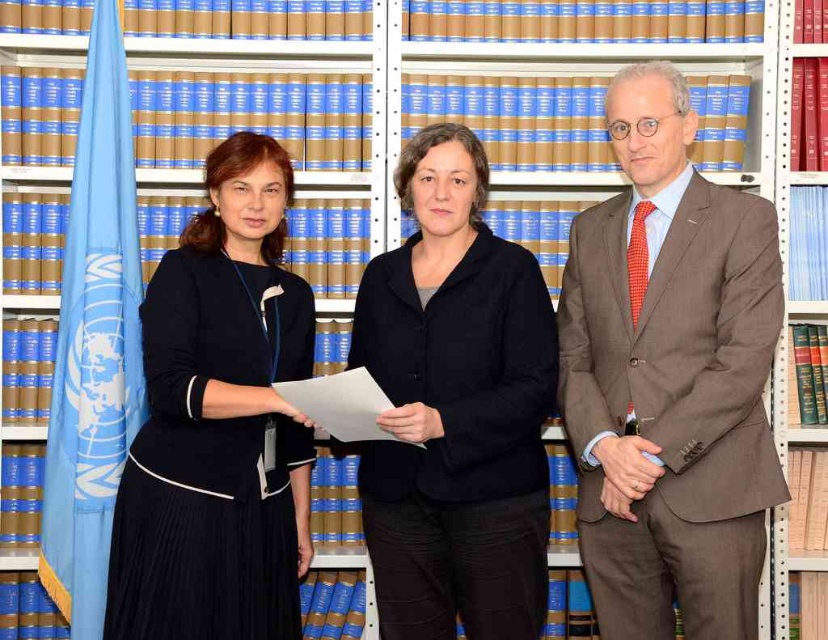
In the scene shown: You are standing in the room and want to take a photo of both the point at [745,337] and the point at [189,604]. Which point should you focus on first to ensure both are in focus?

You should focus on point [745,337] first because it is closer to the camera than point [189,604]. By focusing on the closer point, the farther point will also be within the depth of field.